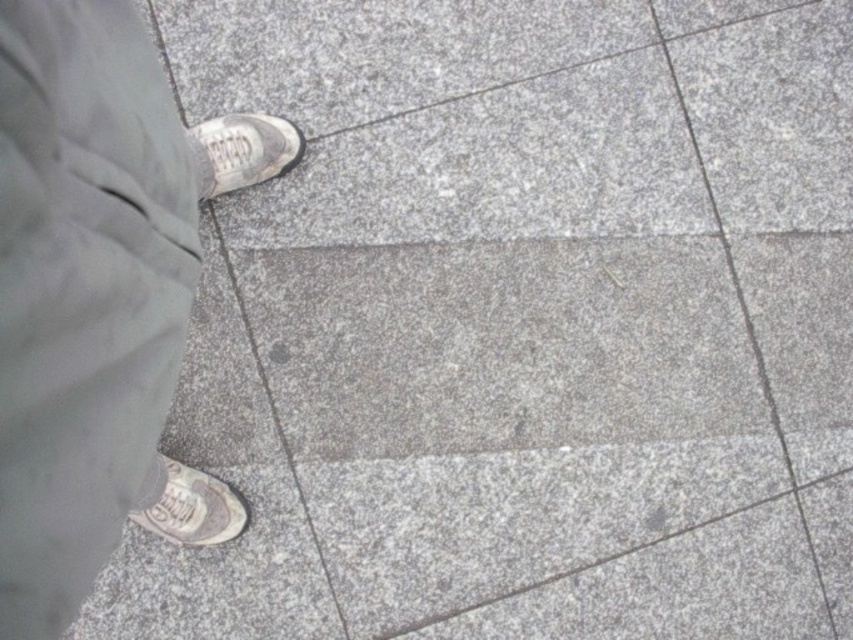
You are a photographer trying to capture the person walking on the pavement. You want to focus on the matte gray pants at lower left. Where should you position your camera relative to the pavement tiles?

The matte gray pants at lower left is located at point (99,296), so you should position your camera to aim at that coordinate to focus on the matte gray pants at lower left.

You are a photographer trying to capture the details of the pavement tiles. You notice the matte gray pants at lower left and the white canvas shoe at upper left in your frame. Which object has a narrower width in the image?

The matte gray pants at lower left has a narrower width than the white canvas shoe at upper left according to the description.